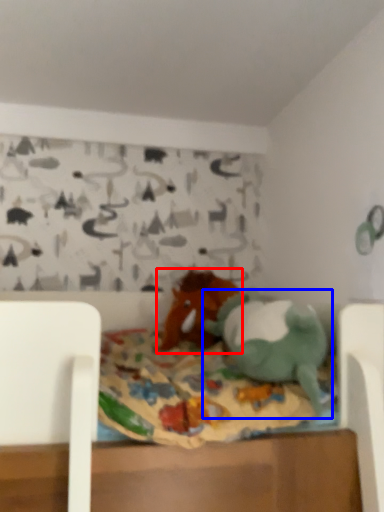
Question: Among these objects, which one is farthest to the camera, toy (highlighted by a red box) or toy (highlighted by a blue box)?

Choices:
 (A) toy
 (B) toy

Answer: (A)